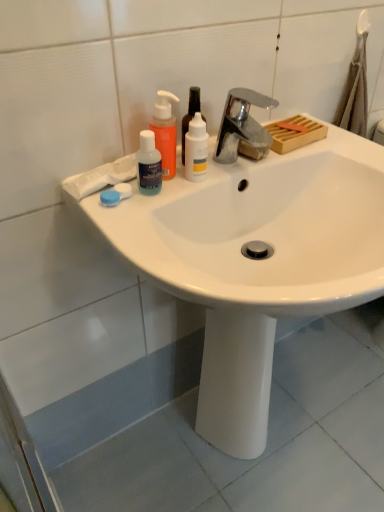
Image resolution: width=384 pixels, height=512 pixels. I want to click on free space in front of translucent plastic mouthwash at upper left, positioned as the 3th mouthwash in right-to-left order, so [x=144, y=234].